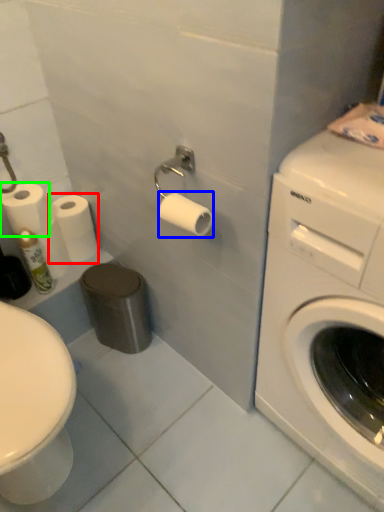
Question: Considering the real-world distances, which object is farthest from toilet paper (highlighted by a red box)? toilet paper (highlighted by a blue box) or toilet paper (highlighted by a green box)?

Choices:
 (A) toilet paper
 (B) toilet paper

Answer: (A)